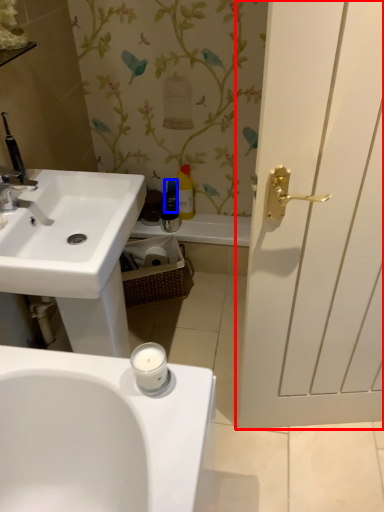
Question: Which object is closer to the camera taking this photo, door (highlighted by a red box) or toiletry (highlighted by a blue box)?

Choices:
 (A) door
 (B) toiletry

Answer: (A)